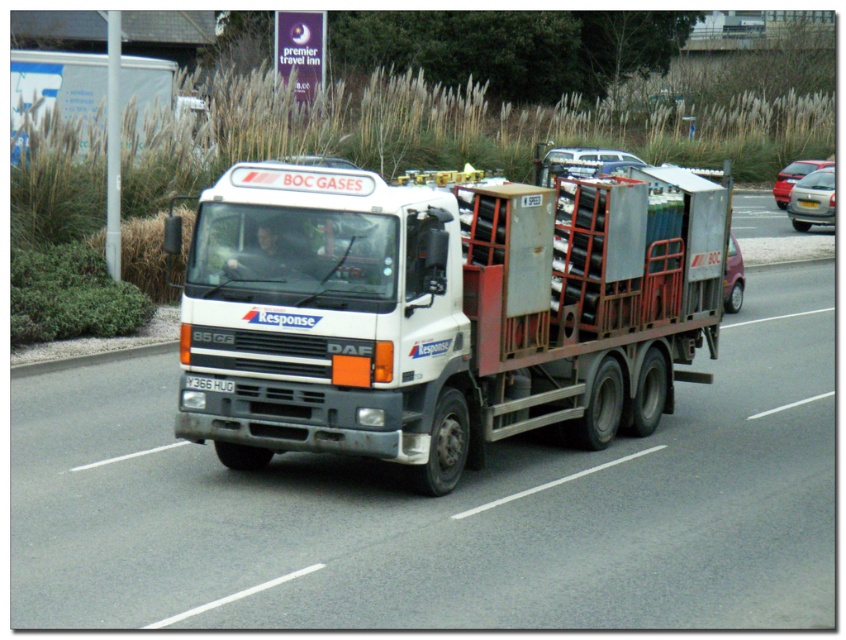
Does metallic silver car at right come in front of white plastic license plate at center?

No, it is not.

What do you see at coordinates (794, 177) in the screenshot? I see `metallic silver car at right` at bounding box center [794, 177].

Measure the distance between point (788, 198) and camera.

Point (788, 198) is 39.48 meters from camera.

Image resolution: width=846 pixels, height=640 pixels. I want to click on metallic silver car at right, so click(794, 177).

Measure the distance from white matte trailer truck at center to white matte van at center.

They are 7.98 meters apart.

Can you confirm if white matte trailer truck at center is shorter than white matte van at center?

Yes.

Describe the element at coordinates (441, 312) in the screenshot. I see `white matte trailer truck at center` at that location.

Locate an element on the screen. This screenshot has width=846, height=640. white matte trailer truck at center is located at coordinates (441, 312).

Locate an element on the screen. The image size is (846, 640). white matte van at center is located at coordinates (583, 163).

Does white matte van at center have a lesser height compared to white plastic license plate at center?

No, white matte van at center is not shorter than white plastic license plate at center.

Between point (561, 170) and point (201, 384), which one is positioned behind?

Positioned behind is point (561, 170).

Image resolution: width=846 pixels, height=640 pixels. What are the coordinates of `white matte van at center` in the screenshot? It's located at (583, 163).